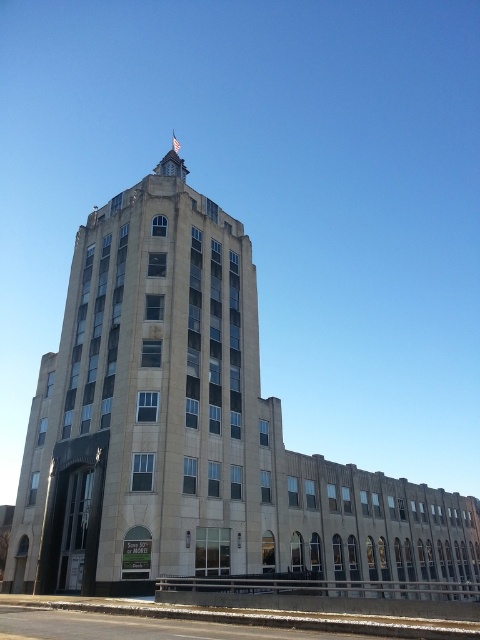
You are standing in front of a historic building and want to take a photo of the beige stone tower at center. If you are 6 feet tall, can you comfortably take a photo without needing to move closer than 85.97 feet?

The beige stone tower at center is 85.97 feet away from the viewer. Since the question states that you are standing at that distance, you can comfortably take a photo without needing to move closer.

You are standing in front of the multi story building. You want to locate the beige stone tower at center. Where should you look?

The beige stone tower at center is located at point (152, 406), so you should look towards the center of the building.

You are standing in front of the building and want to take a photo of both the beige stone tower at center and the stained glass clock at upper center. Which object should you focus on first to ensure both are in clear view?

You should focus on the beige stone tower at center first because it is closer to you than the stained glass clock at upper center. By focusing on the closer object, both will be in clear view as the clock is behind it.